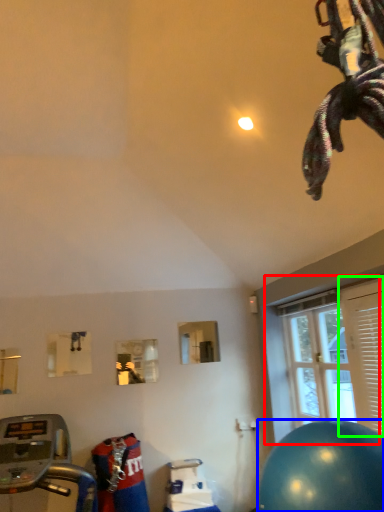
Question: Which is nearer to the window (highlighted by a red box)? ball (highlighted by a blue box) or shutter (highlighted by a green box).

Choices:
 (A) ball
 (B) shutter

Answer: (B)